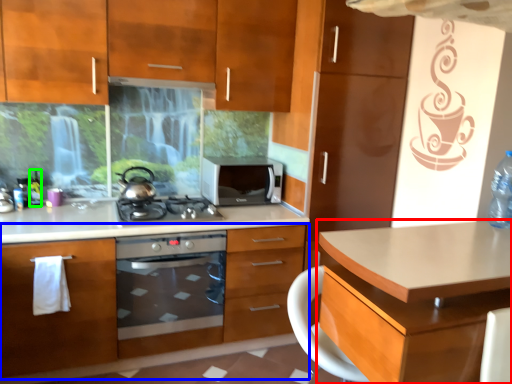
Question: Which object is positioned farthest from desk (highlighted by a red box)? Select from cabinetry (highlighted by a blue box) and bottle (highlighted by a green box).

Choices:
 (A) cabinetry
 (B) bottle

Answer: (B)